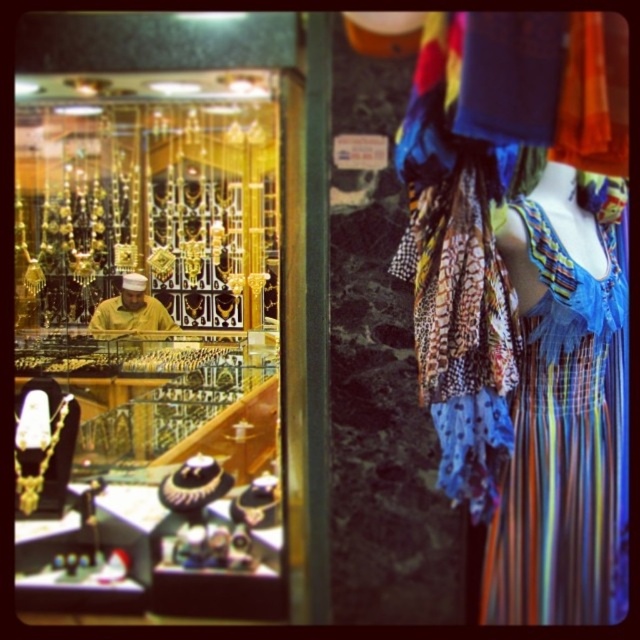
Can you confirm if multicolored striped dress at center is shorter than yellow fabric at center?

No, multicolored striped dress at center is not shorter than yellow fabric at center.

Is point (556, 618) closer to viewer compared to point (106, 323)?

That is True.

This screenshot has width=640, height=640. What are the coordinates of `multicolored striped dress at center` in the screenshot? It's located at (564, 445).

Can you confirm if gold/glass jewelry at center is positioned below multicolored striped dress at center?

No, gold/glass jewelry at center is not below multicolored striped dress at center.

Does gold/glass jewelry at center lie in front of multicolored striped dress at center?

No.

Is point (186, 609) closer to viewer compared to point (624, 579)?

No, it is not.

Locate an element on the screen. gold/glass jewelry at center is located at coordinates (148, 346).

Does gold/glass jewelry at center have a greater width compared to yellow fabric at center?

Correct, the width of gold/glass jewelry at center exceeds that of yellow fabric at center.

Which is more to the left, gold/glass jewelry at center or yellow fabric at center?

Positioned to the left is yellow fabric at center.

Who is more distant from viewer, (132, 99) or (161, 316)?

The point (161, 316) is more distant.

Find the location of a particular element. Image resolution: width=640 pixels, height=640 pixels. gold/glass jewelry at center is located at coordinates (148, 346).